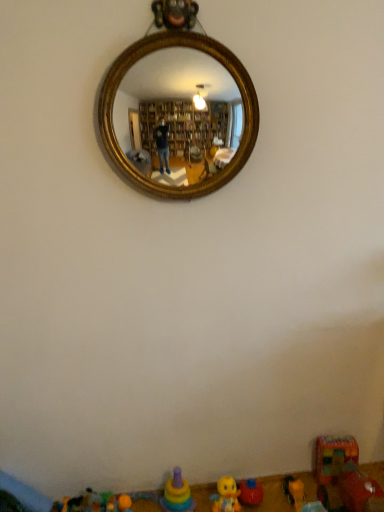
This screenshot has width=384, height=512. Find the location of `unoccupied area behind yellow rubber duck at lower center, which is the fourth toy in right-to-left order`. unoccupied area behind yellow rubber duck at lower center, which is the fourth toy in right-to-left order is located at coordinates (229, 492).